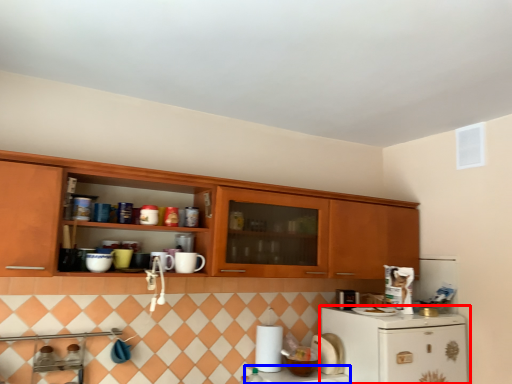
Question: Which object is further to the camera taking this photo, refrigerator (highlighted by a red box) or counter top (highlighted by a blue box)?

Choices:
 (A) refrigerator
 (B) counter top

Answer: (B)